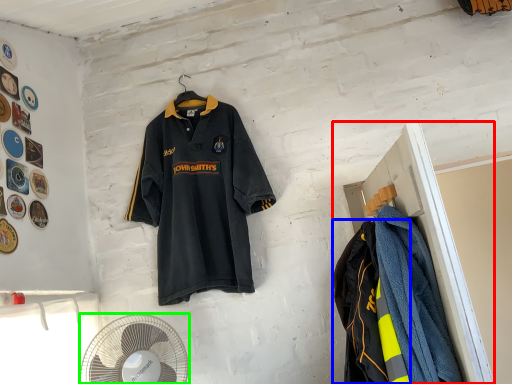
Question: Which is farther away from closet (highlighted by a red box)? garment (highlighted by a blue box) or mechanical fan (highlighted by a green box)?

Choices:
 (A) garment
 (B) mechanical fan

Answer: (B)